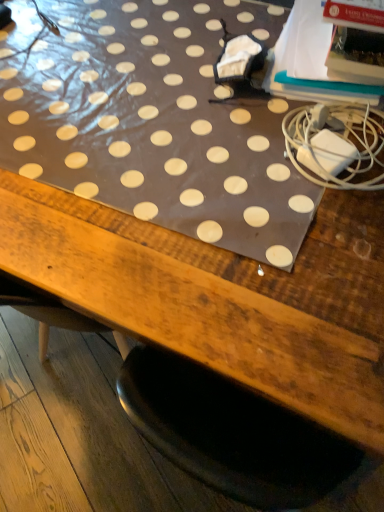
At what (x,y) coordinates should I click in order to perform the action: click on free space in front of white matte cable at upper right. Please return your answer as a coordinate pair (x, y). The height and width of the screenshot is (512, 384). Looking at the image, I should click on (315, 233).